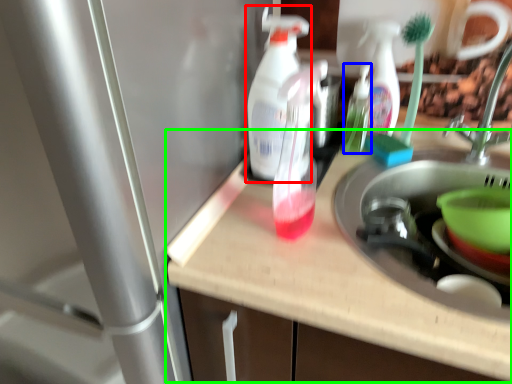
Question: Considering the real-world distances, which object is farthest from cleaning product (highlighted by a red box)? bottle (highlighted by a blue box) or counter top (highlighted by a green box)?

Choices:
 (A) bottle
 (B) counter top

Answer: (A)